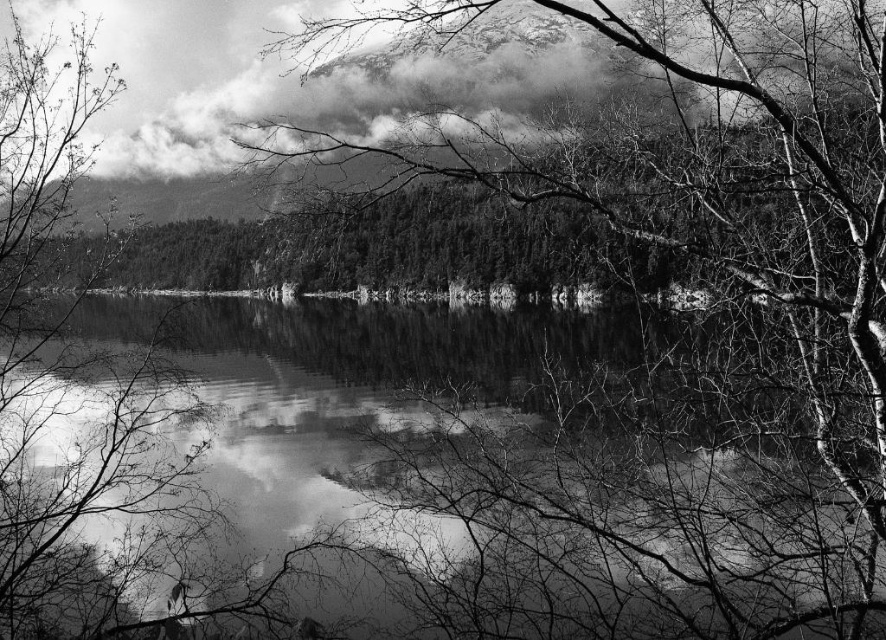
Looking at this image, is smooth water at center shorter than cloudy white cloud at upper center?

Indeed, smooth water at center has a lesser height compared to cloudy white cloud at upper center.

Can you confirm if smooth water at center is wider than cloudy white cloud at upper center?

Incorrect, smooth water at center's width does not surpass cloudy white cloud at upper center's.

The width and height of the screenshot is (886, 640). What do you see at coordinates (418, 474) in the screenshot? I see `smooth water at center` at bounding box center [418, 474].

Where is `smooth water at center`? This screenshot has width=886, height=640. smooth water at center is located at coordinates (418, 474).

Is smooth bark tree at center below cloudy white cloud at upper center?

Correct, smooth bark tree at center is located below cloudy white cloud at upper center.

Is smooth bark tree at center to the left of cloudy white cloud at upper center from the viewer's perspective?

Incorrect, smooth bark tree at center is not on the left side of cloudy white cloud at upper center.

The width and height of the screenshot is (886, 640). Describe the element at coordinates (737, 257) in the screenshot. I see `smooth bark tree at center` at that location.

Where is `smooth bark tree at center`? smooth bark tree at center is located at coordinates (737, 257).

Can you confirm if smooth water at center is wider than smooth bark tree at center?

Indeed, smooth water at center has a greater width compared to smooth bark tree at center.

Can you confirm if smooth water at center is positioned to the right of smooth bark tree at center?

Incorrect, smooth water at center is not on the right side of smooth bark tree at center.

Measure the distance between point (488, 516) and camera.

The distance of point (488, 516) from camera is 283.45 feet.

This screenshot has width=886, height=640. In order to click on smooth water at center in this screenshot , I will do [418, 474].